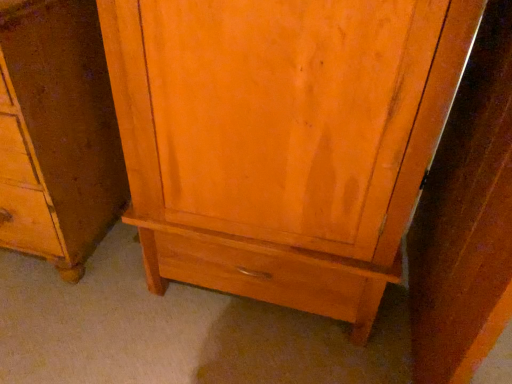
Describe the element at coordinates (278, 229) in the screenshot. Image resolution: width=512 pixels, height=384 pixels. I see `matte wood cupboard at center` at that location.

Locate an element on the screen. The height and width of the screenshot is (384, 512). matte wood cupboard at center is located at coordinates (278, 229).

The width and height of the screenshot is (512, 384). What do you see at coordinates (57, 133) in the screenshot?
I see `matte wood cabinet at center` at bounding box center [57, 133].

Measure the distance between matte wood cabinet at center and camera.

matte wood cabinet at center and camera are 34.93 inches apart.

Identify the location of matte wood cabinet at center. (57, 133).

In order to face matte wood cabinet at center, should I rotate leftwards or rightwards?

Turn left by 31.950 degrees to look at matte wood cabinet at center.

The image size is (512, 384). What are the coordinates of `matte wood cupboard at center` in the screenshot? It's located at pos(278,229).

Which object is positioned more to the right, matte wood cabinet at center or matte wood cupboard at center?

From the viewer's perspective, matte wood cupboard at center appears more on the right side.

Is matte wood cabinet at center in front of or behind matte wood cupboard at center in the image?

matte wood cabinet at center is positioned farther from the viewer than matte wood cupboard at center.

Which is behind, point (36, 244) or point (280, 133)?

The point (36, 244) is farther from the camera.

From the image's perspective, which object appears higher, matte wood cabinet at center or matte wood cupboard at center?

matte wood cabinet at center, from the image's perspective.

From a real-world perspective, between matte wood cabinet at center and matte wood cupboard at center, who is vertically higher?

In real-world perspective, matte wood cupboard at center is above.

Can you confirm if matte wood cabinet at center is wider than matte wood cupboard at center?

Incorrect, the width of matte wood cabinet at center does not surpass that of matte wood cupboard at center.

Which of these two, matte wood cabinet at center or matte wood cupboard at center, stands taller?

With more height is matte wood cupboard at center.

Considering the relative sizes of matte wood cabinet at center and matte wood cupboard at center in the image provided, is matte wood cabinet at center smaller than matte wood cupboard at center?

Yes.

Does matte wood cabinet at center contain matte wood cupboard at center?

No, matte wood cabinet at center does not contain matte wood cupboard at center.

Is matte wood cabinet at center next to matte wood cupboard at center?

matte wood cabinet at center and matte wood cupboard at center are clearly separated.

Is matte wood cabinet at center facing towards matte wood cupboard at center?

No, matte wood cabinet at center is not turned towards matte wood cupboard at center.

Can you tell me how much matte wood cabinet at center and matte wood cupboard at center differ in facing direction?

The facing directions of matte wood cabinet at center and matte wood cupboard at center are 0.262 degrees apart.

The width and height of the screenshot is (512, 384). Identify the location of the chest of drawers that is behind the matte wood cupboard at center. (57, 133).

Considering the relative positions of matte wood cupboard at center and matte wood cabinet at center in the image provided, is matte wood cupboard at center to the left of matte wood cabinet at center from the viewer's perspective?

Incorrect, matte wood cupboard at center is not on the left side of matte wood cabinet at center.

Which object is further away from the camera, matte wood cupboard at center or matte wood cabinet at center?

matte wood cabinet at center.

Which is in front, point (146, 162) or point (80, 11)?

Point (146, 162)

From the image's perspective, which is below, matte wood cupboard at center or matte wood cabinet at center?

matte wood cupboard at center is shown below in the image.

Based on the photo, from a real-world perspective, is matte wood cupboard at center physically located above or below matte wood cabinet at center?

matte wood cupboard at center is situated higher than matte wood cabinet at center in the real world.

Is matte wood cupboard at center wider than matte wood cabinet at center?

Yes.

From their relative heights in the image, would you say matte wood cupboard at center is taller or shorter than matte wood cabinet at center?

matte wood cupboard at center is taller than matte wood cabinet at center.

Based on their sizes in the image, would you say matte wood cupboard at center is bigger or smaller than matte wood cabinet at center?

Clearly, matte wood cupboard at center is larger in size than matte wood cabinet at center.

Is matte wood cupboard at center outside of matte wood cabinet at center?

Yes, matte wood cupboard at center is outside of matte wood cabinet at center.

Is matte wood cupboard at center directly adjacent to matte wood cabinet at center?

matte wood cupboard at center and matte wood cabinet at center are not in contact.

Is matte wood cupboard at center turned away from matte wood cabinet at center?

No.

How far apart are matte wood cupboard at center and matte wood cabinet at center?

matte wood cupboard at center is 17.26 inches from matte wood cabinet at center.

You are a GUI agent. You are given a task and a screenshot of the screen. Output one action in this format:
    pyautogui.click(x=<x>, y=<y>)
    Task: Click on the cupboard on the right of matte wood cabinet at center
    
    Given the screenshot: What is the action you would take?
    pyautogui.click(x=278, y=229)

Identify the location of cupboard positioned vertically above the matte wood cabinet at center (from a real-world perspective). (278, 229).

Identify the location of chest of drawers behind the matte wood cupboard at center. The width and height of the screenshot is (512, 384). click(57, 133).